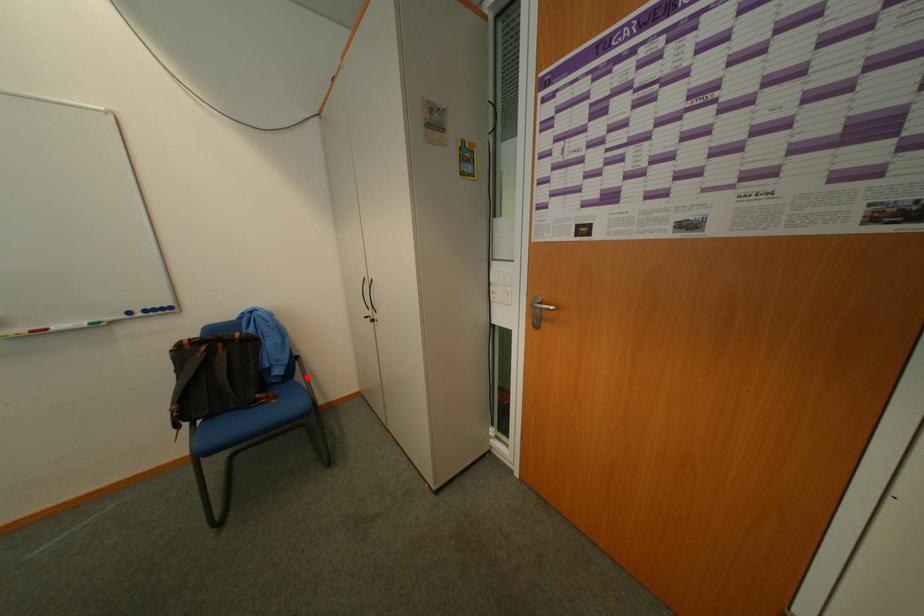
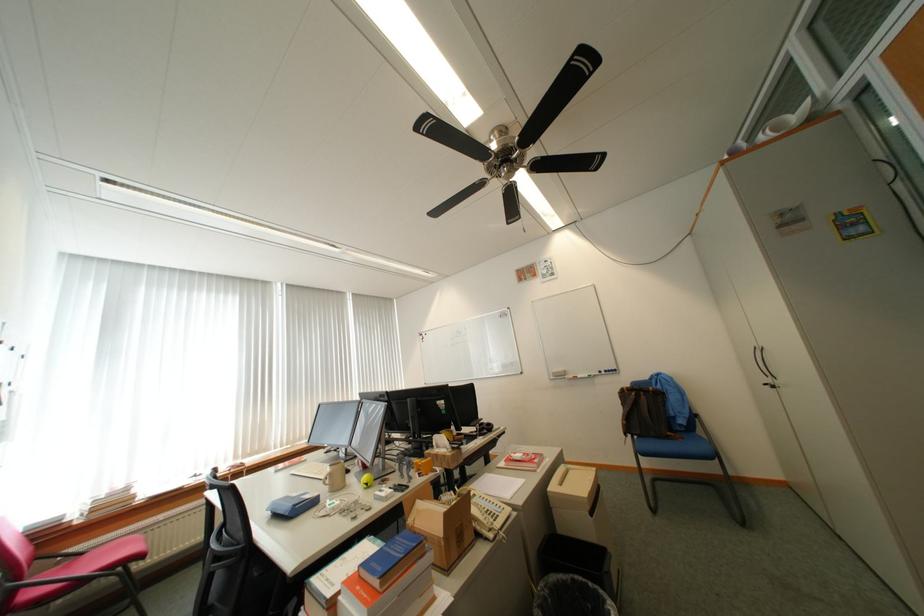
In the second image, find the point that corresponds to the highlighted location in the first image.

(709, 432)